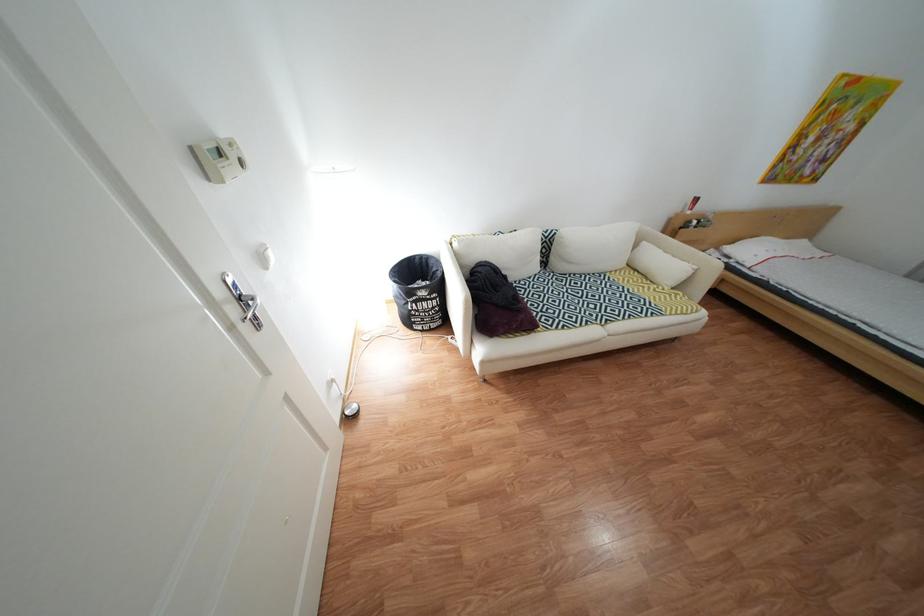
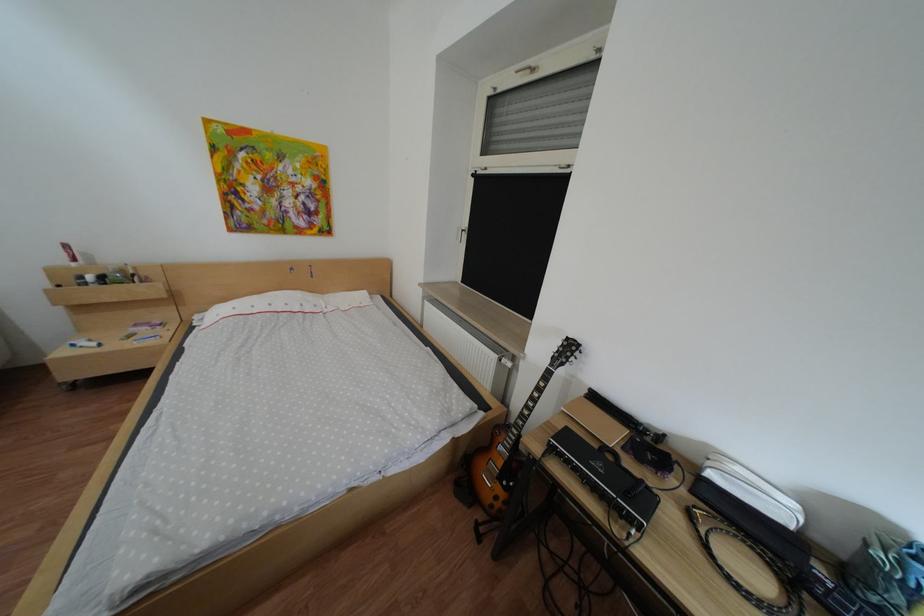
Question: What movement of the cameraman would produce the second image?

Choices:
 (A) Left
 (B) Right
 (C) Forward
 (D) Backward

Answer: (B)